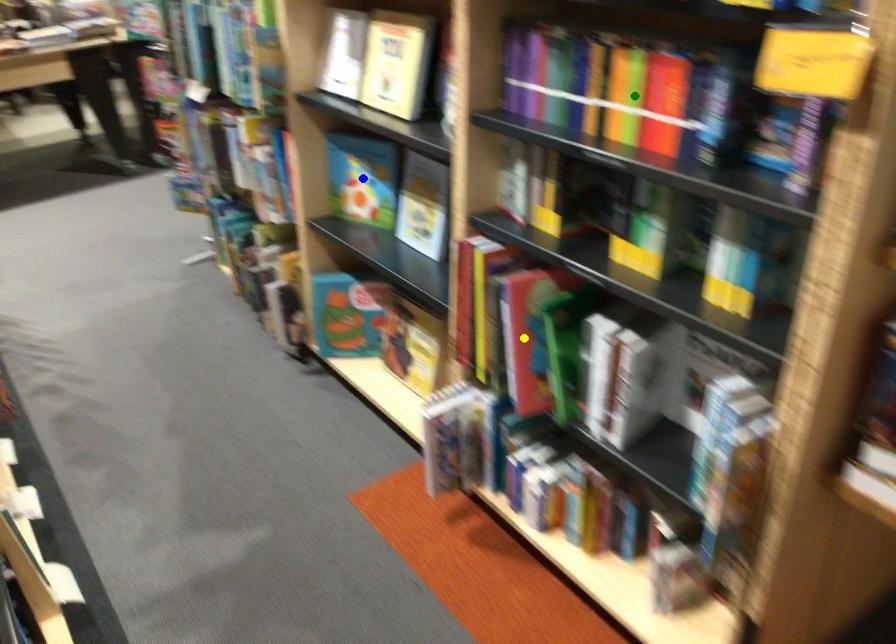
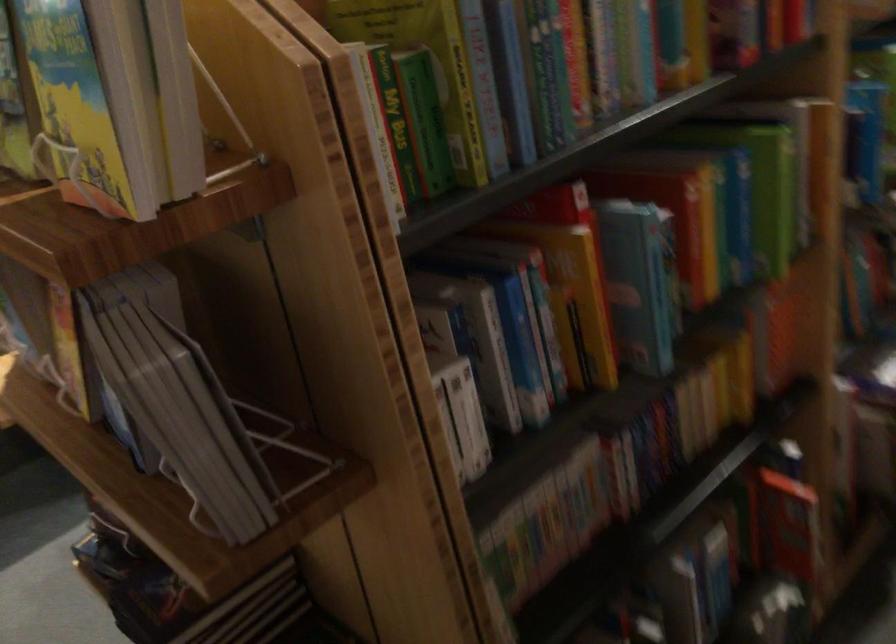
I am providing you with two images of the same scene from different viewpoints. Three points are marked in image1. Which point corresponds to a part or object that is occluded in image2?In image1, three points are marked. Which of them correspond to a part or object that is occluded in image2?Among the three points shown in image1, which one corresponds to a part or object that is no longer visible due to occlusion in image2?

Invisible in image2: yellow point, green point, blue point.